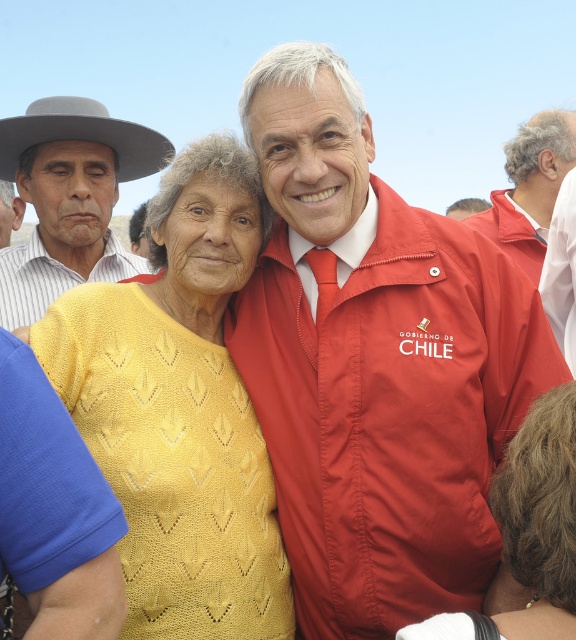
Consider the image. Between gray felt cowboy hat at upper left and matte white shirt at left, which one has less height?

Standing shorter between the two is gray felt cowboy hat at upper left.

Is gray felt cowboy hat at upper left taller than matte white shirt at left?

In fact, gray felt cowboy hat at upper left may be shorter than matte white shirt at left.

Does point (25, 120) lie behind point (14, 195)?

No.

Identify the location of gray felt cowboy hat at upper left. The image size is (576, 640). (81, 134).

Between matte gray hat at left and matte white shirt at left, which one has less height?

matte white shirt at left is shorter.

Does point (70, 128) come in front of point (0, 244)?

Yes, it is in front of point (0, 244).

Who is more distant from viewer, [44,307] or [6,182]?

Point [6,182]

The width and height of the screenshot is (576, 640). What are the coordinates of `matte gray hat at left` in the screenshot? It's located at [70, 198].

Is matte red jacket at center above matte white shirt at left?

No, matte red jacket at center is not above matte white shirt at left.

What do you see at coordinates (376, 364) in the screenshot? I see `matte red jacket at center` at bounding box center [376, 364].

At what (x,y) coordinates should I click in order to perform the action: click on matte red jacket at center. Please return your answer as a coordinate pair (x, y). The width and height of the screenshot is (576, 640). Looking at the image, I should click on (376, 364).

The height and width of the screenshot is (640, 576). What are the coordinates of `matte red jacket at center` in the screenshot? It's located at (376, 364).